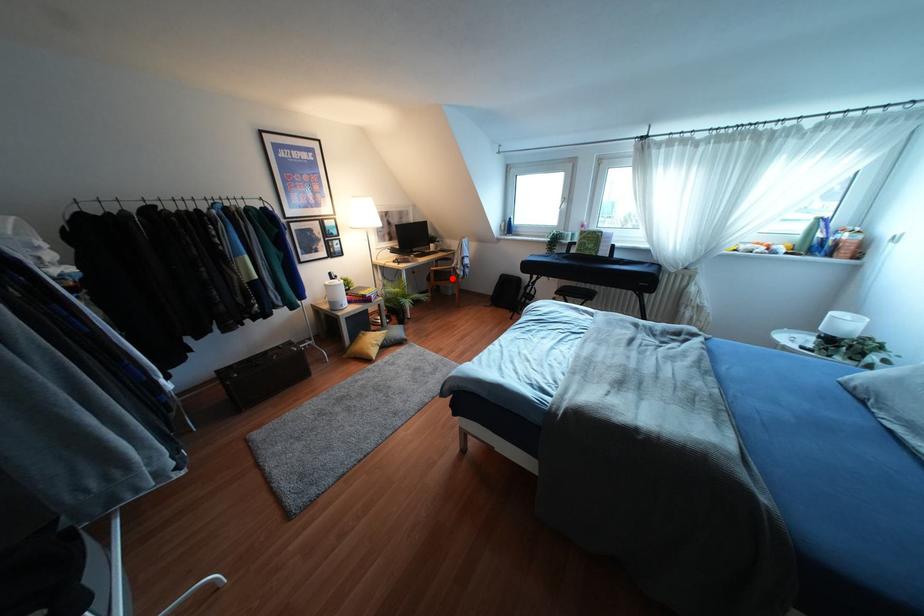
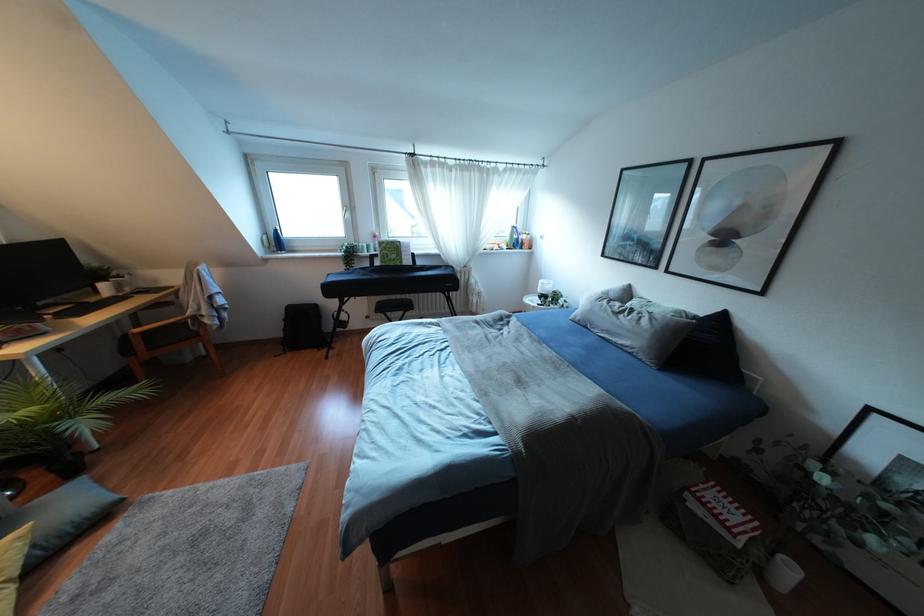
Question: I am providing you with two images of the same scene from different viewpoints. A red point is marked on the first image. At the location where the point appears in image 1, is it still visible in image 2?

Choices:
 (A) Yes
 (B) No

Answer: (A)